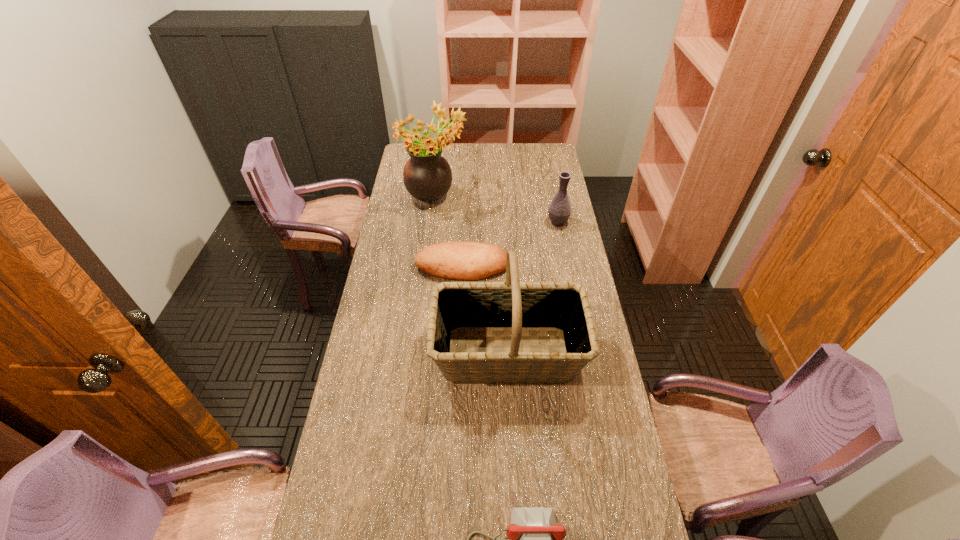
Select which object appears as the second closest to the second nearest object. Please provide its 2D coordinates. Your answer should be formatted as a tuple, i.e. [(x, y)], where the tuple contains the x and y coordinates of a point satisfying the conditions above.

[(536, 539)]

Locate an element on the screen. The height and width of the screenshot is (540, 960). vacant area that satisfies the following two spatial constraints: 1. on the back side of the second shortest object; 2. on the left side of the third tallest object is located at coordinates (464, 222).

Find the location of a particular element. This screenshot has width=960, height=540. free spot that satisfies the following two spatial constraints: 1. on the front side of the flower arrangement; 2. on the right side of the third shortest object is located at coordinates (433, 222).